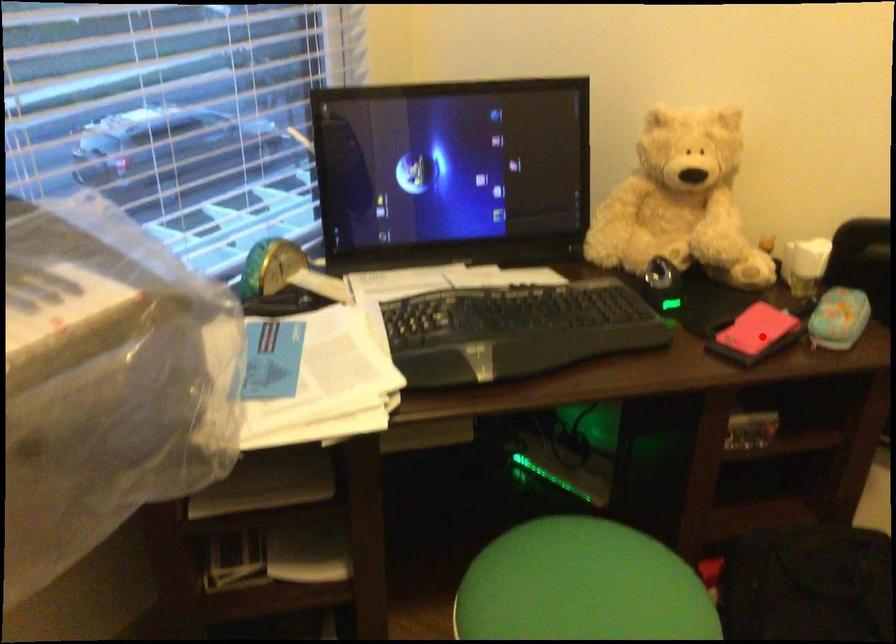
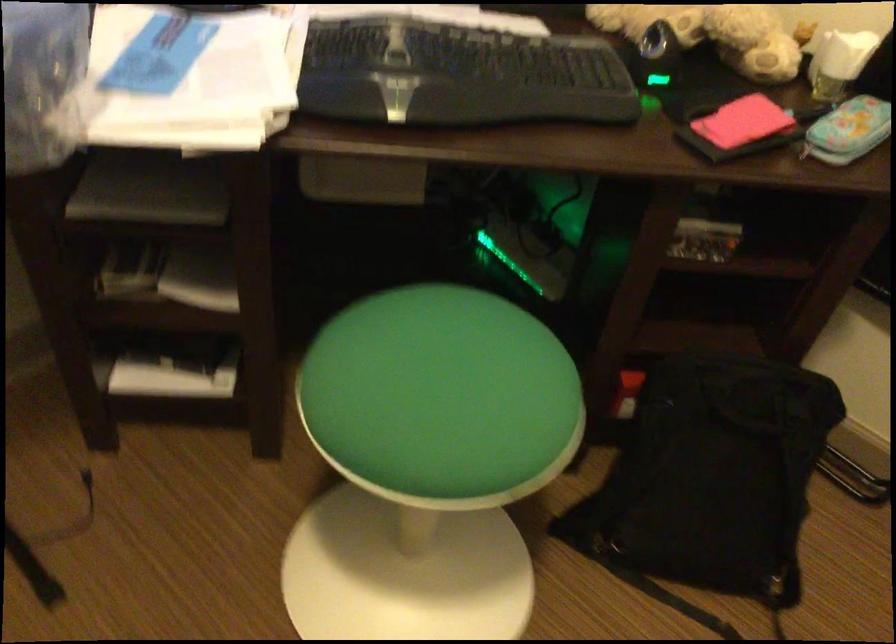
Question: A red point is marked in image1. In image2, is the corresponding 3D point closer to the camera or farther? Reply with the corresponding letter.

Choices:
 (A) The corresponding 3D point is closer.
 (B) The corresponding 3D point is farther.

Answer: (A)